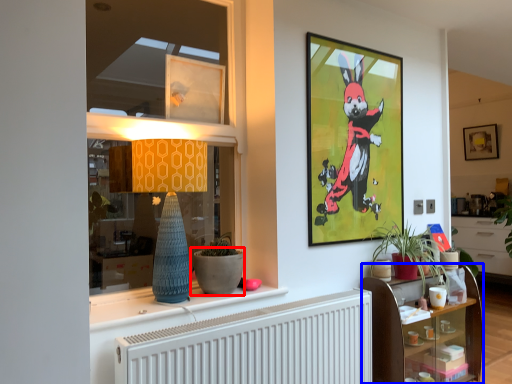
Question: Which point is further to the camera, flowerpot (highlighted by a red box) or shelf (highlighted by a blue box)?

Choices:
 (A) flowerpot
 (B) shelf

Answer: (B)